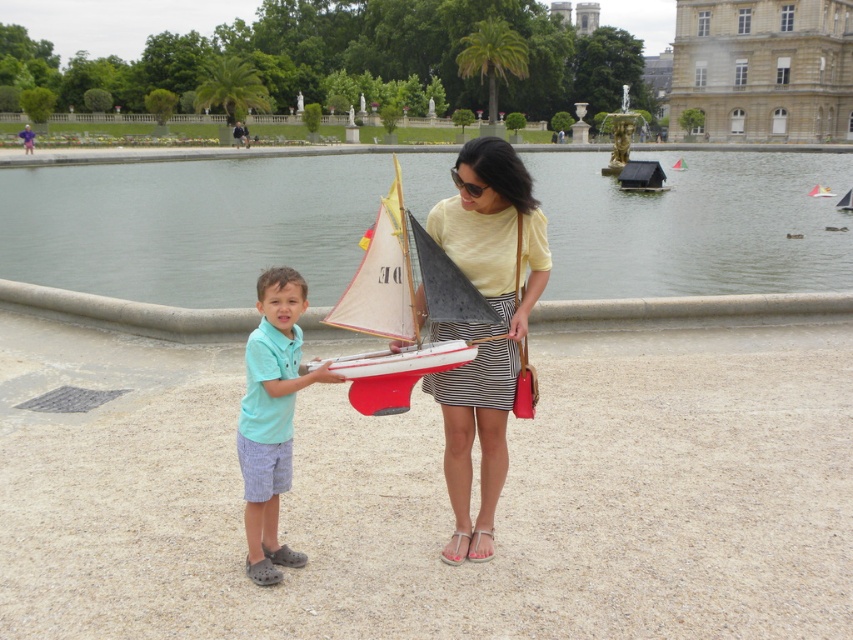
Question: Based on their relative distances, which object is nearer to the teal fabric shirt at center?

Choices:
 (A) white matte sailboat at center
 (B) clear water at lake center

Answer: (A)

Question: Which of these objects is positioned farthest from the brown stone building at upper right?

Choices:
 (A) matte yellow shirt at center
 (B) teal fabric shirt at center
 (C) white matte sailboat at center

Answer: (B)

Question: Which of the following is the closest to the observer?

Choices:
 (A) (483, 221)
 (B) (341, 368)
 (C) (265, 328)

Answer: (B)

Question: Is matte yellow shirt at center positioned before teal fabric shirt at center?

Choices:
 (A) no
 (B) yes

Answer: (A)

Question: Does clear water at lake center have a larger size compared to teal fabric shirt at center?

Choices:
 (A) no
 (B) yes

Answer: (B)

Question: Is the position of matte yellow shirt at center more distant than that of white matte sailboat at center?

Choices:
 (A) yes
 (B) no

Answer: (A)